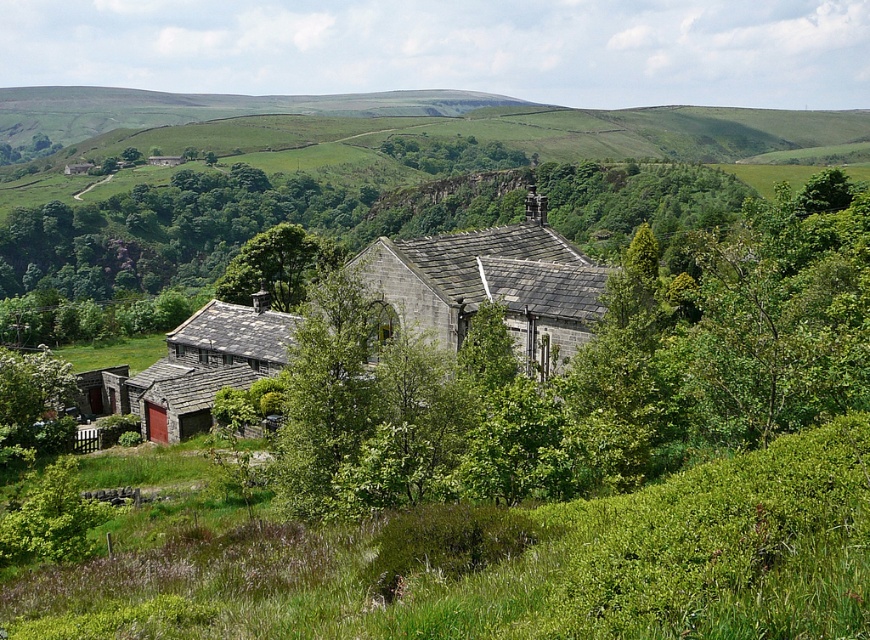
Is point (559, 362) behind point (246, 272)?

No.

Does gray stone building at center have a greater width compared to green leafy tree at center?

No, gray stone building at center is not wider than green leafy tree at center.

Measure the distance between point (576, 339) and camera.

127.64 feet

Locate an element on the screen. gray stone building at center is located at coordinates (492, 284).

Is gray stone building at center to the left of stone textured hut at lower left from the viewer's perspective?

Incorrect, gray stone building at center is not on the left side of stone textured hut at lower left.

The width and height of the screenshot is (870, 640). Find the location of `gray stone building at center`. gray stone building at center is located at coordinates (492, 284).

I want to click on gray stone building at center, so click(492, 284).

Does green leafy grass at lower center appear on the right side of green leafy tree at center?

Indeed, green leafy grass at lower center is positioned on the right side of green leafy tree at center.

Looking at this image, who is more distant from viewer, (x=658, y=554) or (x=255, y=241)?

The point (x=255, y=241) is more distant.

You are a GUI agent. You are given a task and a screenshot of the screen. Output one action in this format:
    pyautogui.click(x=<x>, y=<y>)
    Task: Click on the green leafy grass at lower center
    The image size is (870, 640).
    Given the screenshot: What is the action you would take?
    pyautogui.click(x=516, y=564)